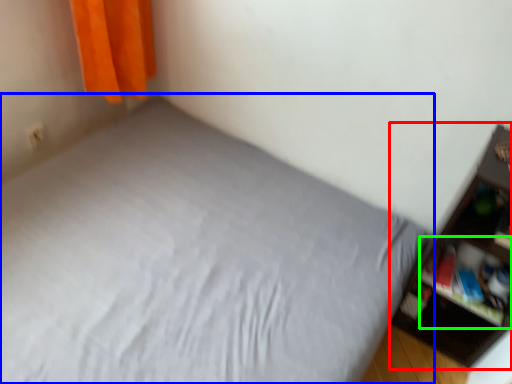
Question: Estimate the real-world distances between objects in this image. Which object is farther from shelf (highlighted by a red box), bed (highlighted by a blue box) or cabinet (highlighted by a green box)?

Choices:
 (A) bed
 (B) cabinet

Answer: (A)